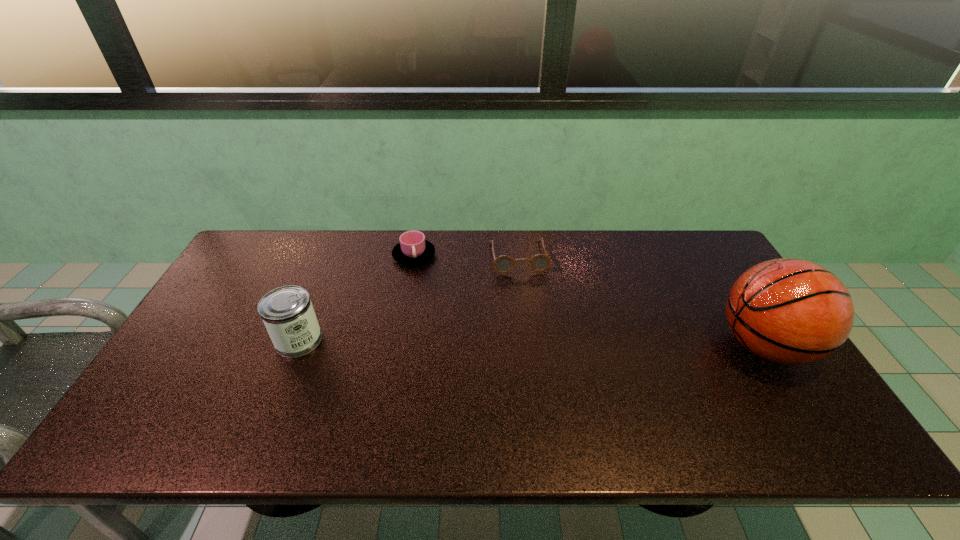
Locate an element on the screen. The image size is (960, 540). free space on the desktop that is between the third shortest object and the basketball and is positioned on the front-facing side of the spectacles is located at coordinates (536, 343).

The width and height of the screenshot is (960, 540). Find the location of `free space on the desktop that is between the leftmost object and the tallest object and is positioned on the side with the handle of the cup`. free space on the desktop that is between the leftmost object and the tallest object and is positioned on the side with the handle of the cup is located at coordinates (473, 342).